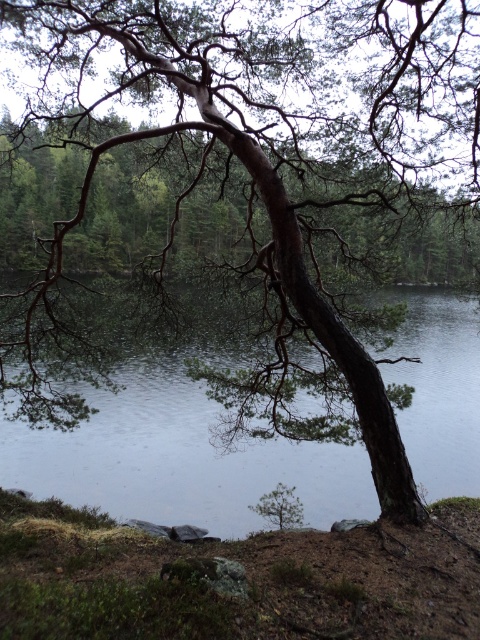
Is brown dirt at lower center bigger than transparent water at center?

Yes, brown dirt at lower center is bigger than transparent water at center.

Who is more forward, (36, 502) or (115, 461)?

Point (36, 502) is more forward.

This screenshot has width=480, height=640. Find the location of `brown dirt at lower center`. brown dirt at lower center is located at coordinates tap(235, 580).

Locate an element on the screen. The image size is (480, 640). brown dirt at lower center is located at coordinates (235, 580).